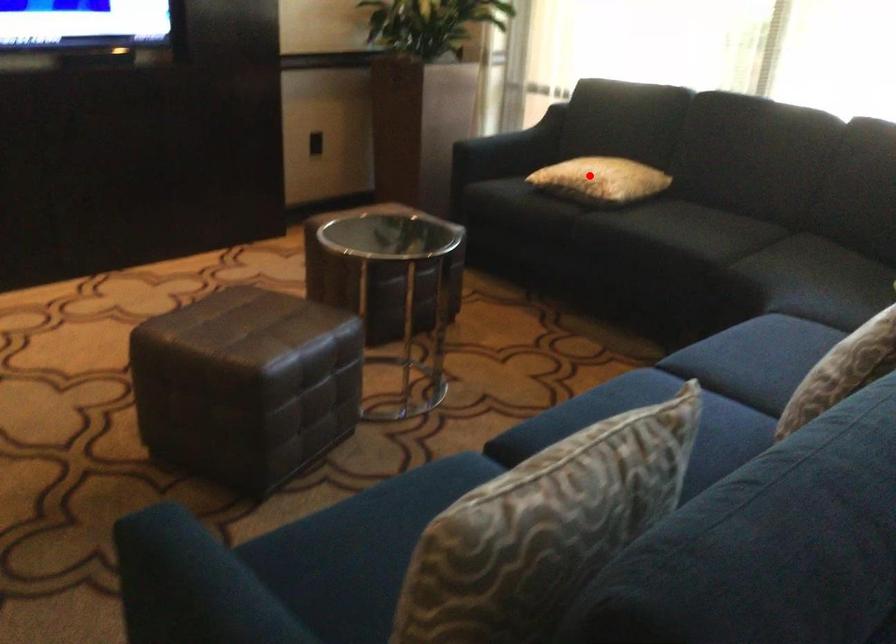
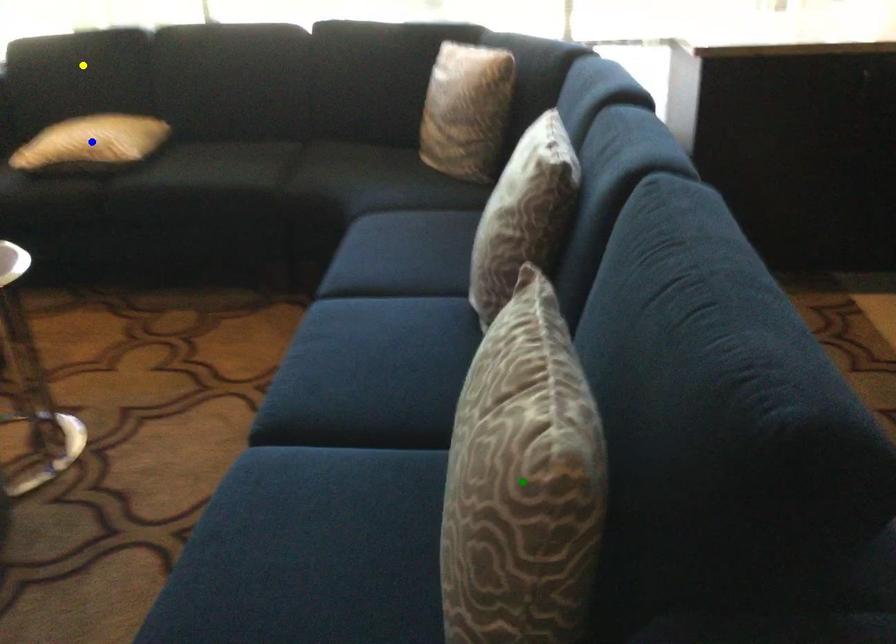
Question: I am providing you with two images of the same scene from different viewpoints. A red point is marked on the first image. You are given multiple points on the second image. Which point in image 2 represents the same 3d spot as the red point in image 1?

Choices:
 (A) blue point
 (B) yellow point
 (C) green point

Answer: (A)